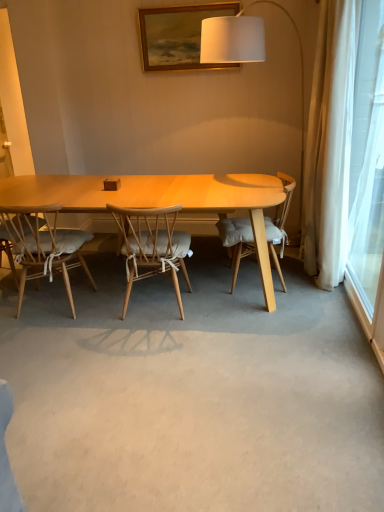
Where is `empty space that is to the right of light wood chair with cushion at center, the 1th chair positioned from the right`? The height and width of the screenshot is (512, 384). empty space that is to the right of light wood chair with cushion at center, the 1th chair positioned from the right is located at coordinates (308, 289).